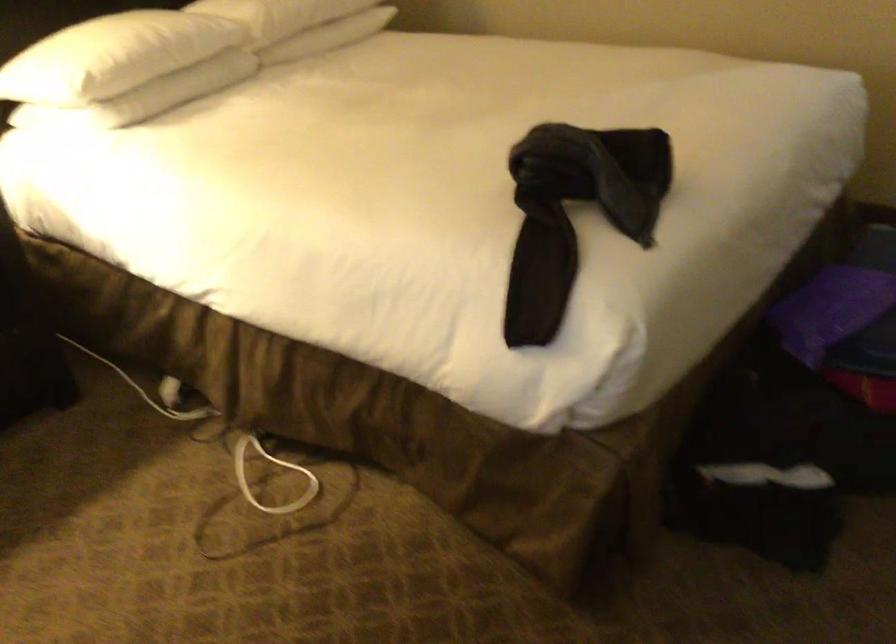
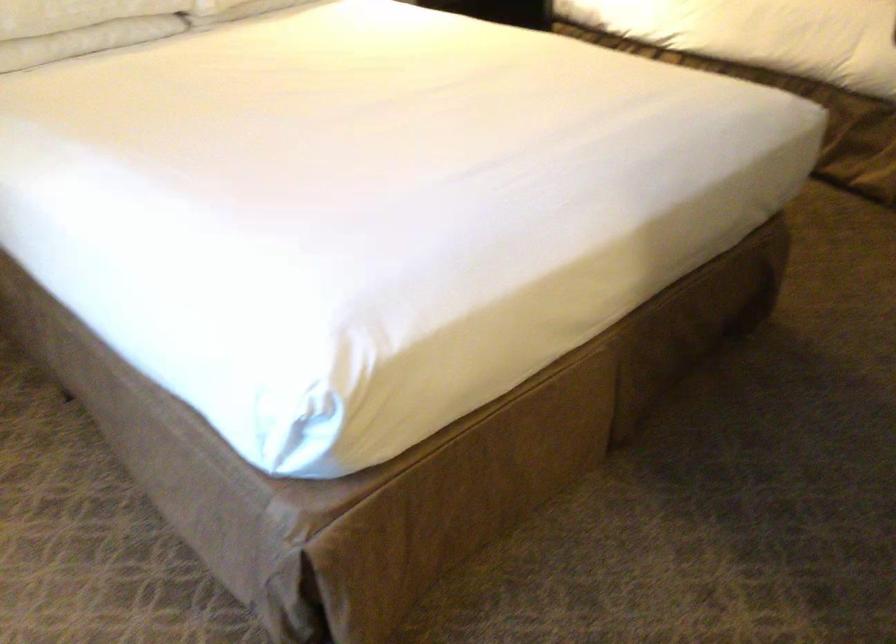
In the second image, find the point that corresponds to [475,364] in the first image.

(874, 53)